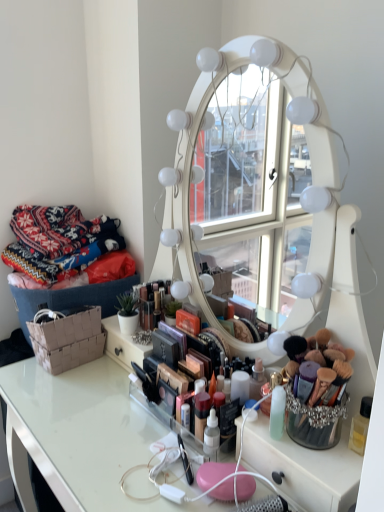
Question: Considering the relative sizes of brown woven basket at lower left and clear acrylic table at center in the image provided, is brown woven basket at lower left smaller than clear acrylic table at center?

Choices:
 (A) no
 (B) yes

Answer: (B)

Question: Is brown woven basket at lower left at the left side of clear acrylic table at center?

Choices:
 (A) yes
 (B) no

Answer: (A)

Question: Can you confirm if brown woven basket at lower left is bigger than clear acrylic table at center?

Choices:
 (A) no
 (B) yes

Answer: (A)

Question: From a real-world perspective, is brown woven basket at lower left located higher than clear acrylic table at center?

Choices:
 (A) yes
 (B) no

Answer: (A)

Question: Is brown woven basket at lower left oriented towards clear acrylic table at center?

Choices:
 (A) no
 (B) yes

Answer: (A)

Question: In the image, is knitted fabric at left positioned in front of or behind clear acrylic table at center?

Choices:
 (A) behind
 (B) front

Answer: (A)

Question: Do you think knitted fabric at left is within clear acrylic table at center, or outside of it?

Choices:
 (A) inside
 (B) outside

Answer: (B)

Question: From a real-world perspective, is knitted fabric at left positioned above or below clear acrylic table at center?

Choices:
 (A) below
 (B) above

Answer: (B)

Question: From their relative heights in the image, would you say knitted fabric at left is taller or shorter than clear acrylic table at center?

Choices:
 (A) tall
 (B) short

Answer: (B)

Question: Choose the correct answer: Is knitted fabric at left inside brown woven basket at lower left or outside it?

Choices:
 (A) outside
 (B) inside

Answer: (A)

Question: Considering the positions of knitted fabric at left and brown woven basket at lower left in the image, is knitted fabric at left bigger or smaller than brown woven basket at lower left?

Choices:
 (A) small
 (B) big

Answer: (B)

Question: Based on their positions, is knitted fabric at left located to the left or right of brown woven basket at lower left?

Choices:
 (A) right
 (B) left

Answer: (B)

Question: From their relative heights in the image, would you say knitted fabric at left is taller or shorter than brown woven basket at lower left?

Choices:
 (A) short
 (B) tall

Answer: (B)

Question: Is point (72, 355) closer or farther from the camera than point (61, 453)?

Choices:
 (A) closer
 (B) farther

Answer: (B)

Question: In terms of width, does brown woven basket at lower left look wider or thinner when compared to clear acrylic table at center?

Choices:
 (A) wide
 (B) thin

Answer: (B)